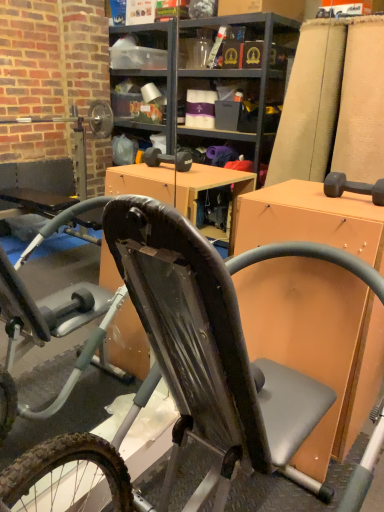
The width and height of the screenshot is (384, 512). What do you see at coordinates (317, 342) in the screenshot? I see `orange matte desk at center` at bounding box center [317, 342].

This screenshot has height=512, width=384. Find the location of `orange matte desk at center`. orange matte desk at center is located at coordinates (317, 342).

Image resolution: width=384 pixels, height=512 pixels. What do you see at coordinates (212, 342) in the screenshot?
I see `black rubber bicycle at center` at bounding box center [212, 342].

This screenshot has height=512, width=384. I want to click on black rubber bicycle at center, so click(x=212, y=342).

Looking at this image, what is the approximate height of black rubber bicycle at center?

black rubber bicycle at center is 1.08 meters tall.

The width and height of the screenshot is (384, 512). What are the coordinates of `orange matte desk at center` in the screenshot? It's located at (317, 342).

Between orange matte desk at center and black rubber bicycle at center, which one appears on the left side from the viewer's perspective?

From the viewer's perspective, black rubber bicycle at center appears more on the left side.

Does orange matte desk at center come in front of black rubber bicycle at center?

No, it is behind black rubber bicycle at center.

Which point is more forward, [299,240] or [293,394]?

The point [293,394] is more forward.

From the picture: From the image's perspective, is orange matte desk at center located above black rubber bicycle at center?

Indeed, from the image's perspective, orange matte desk at center is shown above black rubber bicycle at center.

From a real-world perspective, which is physically below, orange matte desk at center or black rubber bicycle at center?

orange matte desk at center.

Is orange matte desk at center thinner than black rubber bicycle at center?

Yes.

In terms of height, does orange matte desk at center look taller or shorter compared to black rubber bicycle at center?

Considering their sizes, orange matte desk at center has less height than black rubber bicycle at center.

Does orange matte desk at center have a larger size compared to black rubber bicycle at center?

No, orange matte desk at center is not bigger than black rubber bicycle at center.

Is orange matte desk at center located outside black rubber bicycle at center?

Yes, orange matte desk at center is outside of black rubber bicycle at center.

Are orange matte desk at center and black rubber bicycle at center far apart?

orange matte desk at center is actually quite close to black rubber bicycle at center.

Is orange matte desk at center oriented towards black rubber bicycle at center?

No, orange matte desk at center does not turn towards black rubber bicycle at center.

In the image, there is a black rubber bicycle at center. Find the location of `desk above it (from the image's perspective)`. desk above it (from the image's perspective) is located at coordinates (317, 342).

Considering the positions of objects black rubber bicycle at center and orange matte desk at center in the image provided, who is more to the left, black rubber bicycle at center or orange matte desk at center?

black rubber bicycle at center is more to the left.

Considering the positions of objects black rubber bicycle at center and orange matte desk at center in the image provided, who is behind, black rubber bicycle at center or orange matte desk at center?

orange matte desk at center is further from the camera.

Considering the positions of points (179, 409) and (356, 291), is point (179, 409) farther from camera compared to point (356, 291)?

No, (179, 409) is closer to viewer.

From the image's perspective, which object appears higher, black rubber bicycle at center or orange matte desk at center?

From the image's view, orange matte desk at center is above.

From a real-world perspective, is black rubber bicycle at center under orange matte desk at center?

No, from a real-world perspective, black rubber bicycle at center is not beneath orange matte desk at center.

Can you confirm if black rubber bicycle at center is thinner than orange matte desk at center?

Incorrect, the width of black rubber bicycle at center is not less than that of orange matte desk at center.

Which of these two, black rubber bicycle at center or orange matte desk at center, stands shorter?

With less height is orange matte desk at center.

Considering the sizes of objects black rubber bicycle at center and orange matte desk at center in the image provided, who is bigger, black rubber bicycle at center or orange matte desk at center?

Bigger between the two is black rubber bicycle at center.

Is orange matte desk at center a part of black rubber bicycle at center?

Actually, orange matte desk at center is outside black rubber bicycle at center.

Is black rubber bicycle at center in contact with orange matte desk at center?

There is a gap between black rubber bicycle at center and orange matte desk at center.

Is black rubber bicycle at center facing towards orange matte desk at center?

No, black rubber bicycle at center does not turn towards orange matte desk at center.

How many degrees apart are the facing directions of black rubber bicycle at center and orange matte desk at center?

The angular difference between black rubber bicycle at center and orange matte desk at center is 0.925 degrees.

What are the coordinates of `desk that is under the black rubber bicycle at center (from a real-world perspective)` in the screenshot? It's located at (317, 342).

Identify the location of desk that appears behind the black rubber bicycle at center. (317, 342).

In order to click on desk above the black rubber bicycle at center (from the image's perspective) in this screenshot , I will do `click(317, 342)`.